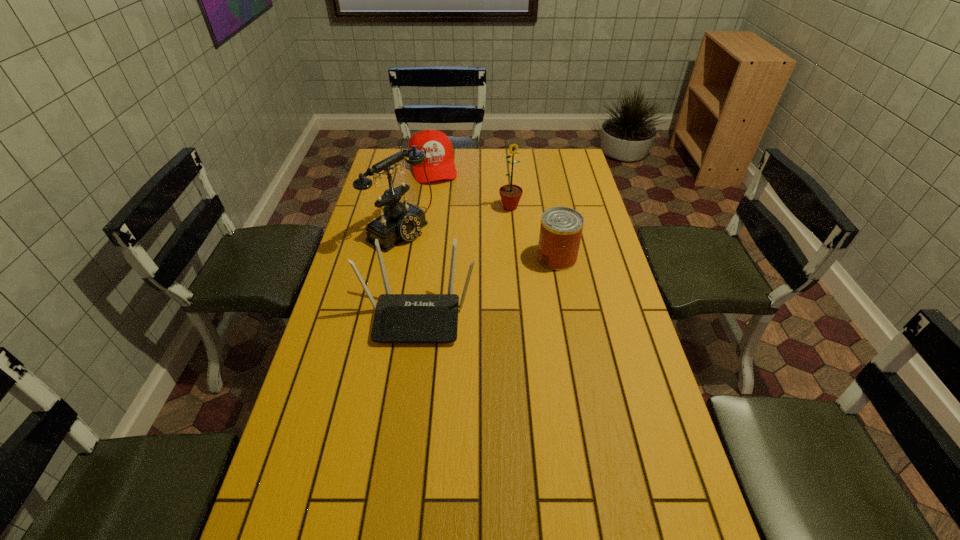
Find the location of `the nearest object`. the nearest object is located at coordinates (398, 317).

Find the location of a particular element. The height and width of the screenshot is (540, 960). router is located at coordinates (398, 317).

This screenshot has width=960, height=540. I want to click on the rightmost object, so pos(561,228).

Locate an element on the screen. The image size is (960, 540). sunflower is located at coordinates (510, 194).

Identify the location of the farthest object. The height and width of the screenshot is (540, 960). (439, 164).

You are a GUI agent. You are given a task and a screenshot of the screen. Output one action in this format:
    pyautogui.click(x=<x>, y=<y>)
    Task: Click on the telephone
    The image size is (960, 540).
    Given the screenshot: What is the action you would take?
    [x=400, y=221]

Locate an element on the screen. vacant position located on the front-facing side of the router is located at coordinates (401, 438).

This screenshot has width=960, height=540. In order to click on vacant region located 0.270m on the back of the can in this screenshot , I will do `click(546, 201)`.

This screenshot has width=960, height=540. I want to click on vacant space situated on the face of the fourth object from left to right, so click(509, 280).

Locate an element on the screen. This screenshot has width=960, height=540. vacant space positioned on the face of the fourth object from left to right is located at coordinates (510, 234).